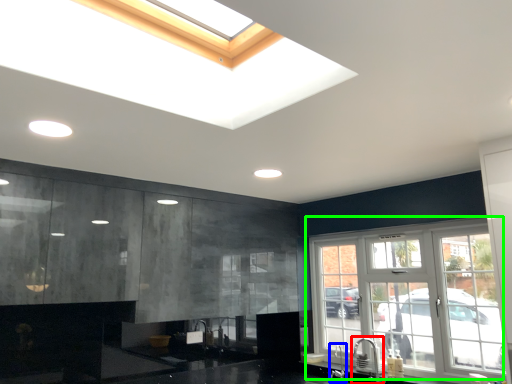
Question: Which object is positioned closest to faucet (highlighted by a red box)? Select from faucet (highlighted by a blue box) and window (highlighted by a green box).

Choices:
 (A) faucet
 (B) window

Answer: (A)